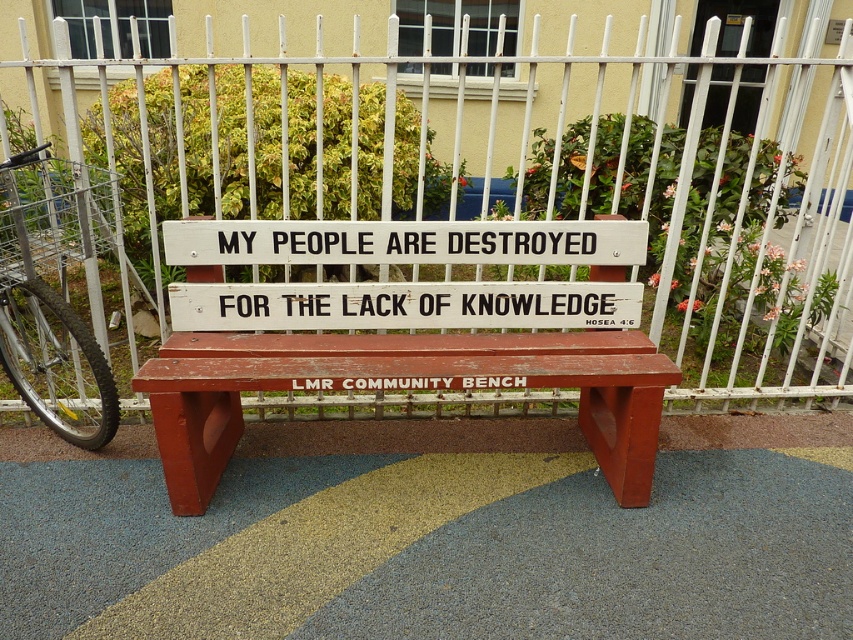
Which is above, white wood sign at center or silver metallic bicycle at left?

silver metallic bicycle at left is higher up.

Is point (281, 243) farther from camera compared to point (28, 156)?

No, (281, 243) is in front of (28, 156).

Between point (169, 237) and point (62, 422), which one is positioned in front?

Point (169, 237) is more forward.

You are a GUI agent. You are given a task and a screenshot of the screen. Output one action in this format:
    pyautogui.click(x=<x>, y=<y>)
    Task: Click on the white wood sign at center
    Image resolution: width=853 pixels, height=640 pixels.
    Given the screenshot: What is the action you would take?
    pyautogui.click(x=402, y=305)

Which is above, white metal fence at center or white wood sign at center?

white metal fence at center

Is white metal fence at center above white wood sign at center?

Yes, white metal fence at center is above white wood sign at center.

At what (x,y) coordinates should I click in order to perform the action: click on white metal fence at center. Please return your answer as a coordinate pair (x, y). The width and height of the screenshot is (853, 640). Looking at the image, I should click on (448, 182).

Is point (405, 224) closer to camera compared to point (519, 252)?

Yes, point (405, 224) is closer to viewer.

Which of these two, wooden bench at center or white wood sign at center, stands taller?

wooden bench at center

Is point (647, 339) farther from camera compared to point (549, 253)?

Yes, it is.

Locate an element on the screen. wooden bench at center is located at coordinates (404, 333).